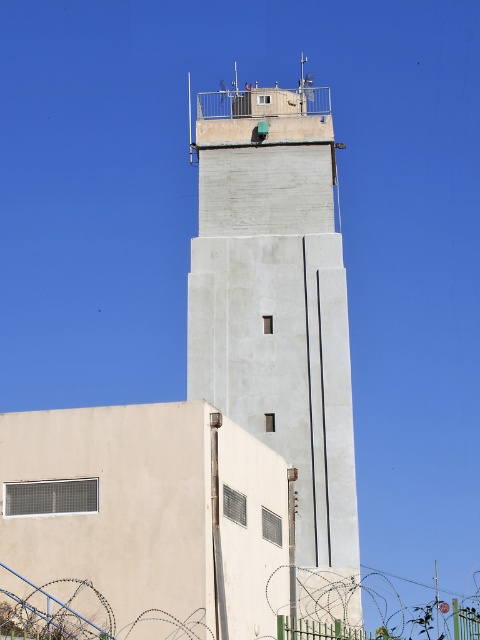
Between concrete tower at upper center and green wire mesh fence at center, which one appears on the right side from the viewer's perspective?

green wire mesh fence at center

Can you confirm if concrete tower at upper center is wider than green wire mesh fence at center?

Correct, the width of concrete tower at upper center exceeds that of green wire mesh fence at center.

Is point (336, 301) positioned in front of point (295, 627)?

No, (336, 301) is behind (295, 627).

Locate an element on the screen. This screenshot has height=640, width=480. concrete tower at upper center is located at coordinates (279, 314).